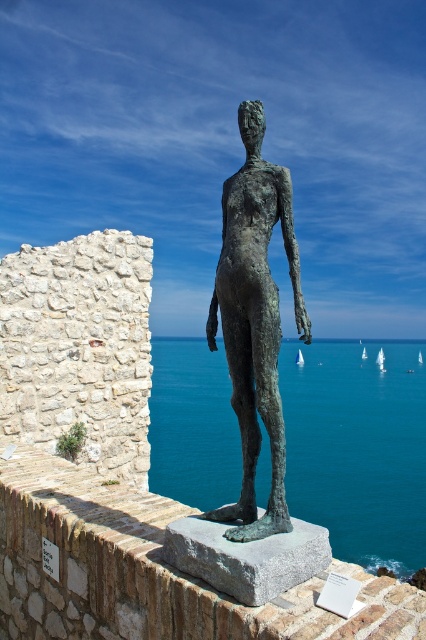
You are a maintenance worker inspecting the sculpture. You notice a point at coordinates point (147, 572). Where exactly is this point located in relation to the sculpture and its base?

The point (147, 572) is on the brick stone ledge at center, which is part of the base supporting the sculpture.